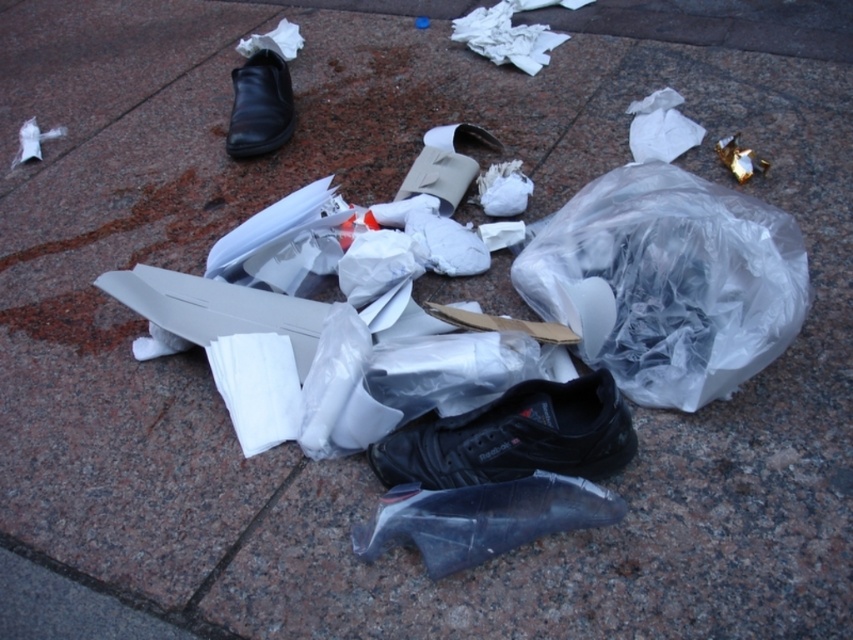
Who is positioned more to the left, transparent plastic bag at center or transparent plastic shoe at center?

transparent plastic shoe at center

Is transparent plastic bag at center above transparent plastic shoe at center?

Yes, transparent plastic bag at center is above transparent plastic shoe at center.

Between point (677, 400) and point (625, 508), which one is positioned behind?

Positioned behind is point (677, 400).

The width and height of the screenshot is (853, 640). What are the coordinates of `transparent plastic bag at center` in the screenshot? It's located at (668, 282).

Is black matte shoe at center to the right of transparent plastic shoe at center from the viewer's perspective?

Yes, black matte shoe at center is to the right of transparent plastic shoe at center.

Who is more forward, (x=490, y=474) or (x=492, y=516)?

Point (x=492, y=516) is in front.

The height and width of the screenshot is (640, 853). What are the coordinates of `black matte shoe at center` in the screenshot? It's located at (514, 436).

This screenshot has width=853, height=640. I want to click on black matte shoe at center, so click(514, 436).

Who is taller, transparent plastic bag at center or black matte shoe at center?

Standing taller between the two is transparent plastic bag at center.

The height and width of the screenshot is (640, 853). Describe the element at coordinates (668, 282) in the screenshot. I see `transparent plastic bag at center` at that location.

You are a GUI agent. You are given a task and a screenshot of the screen. Output one action in this format:
    pyautogui.click(x=<x>, y=<y>)
    Task: Click on the transparent plastic bag at center
    
    Given the screenshot: What is the action you would take?
    [668, 282]